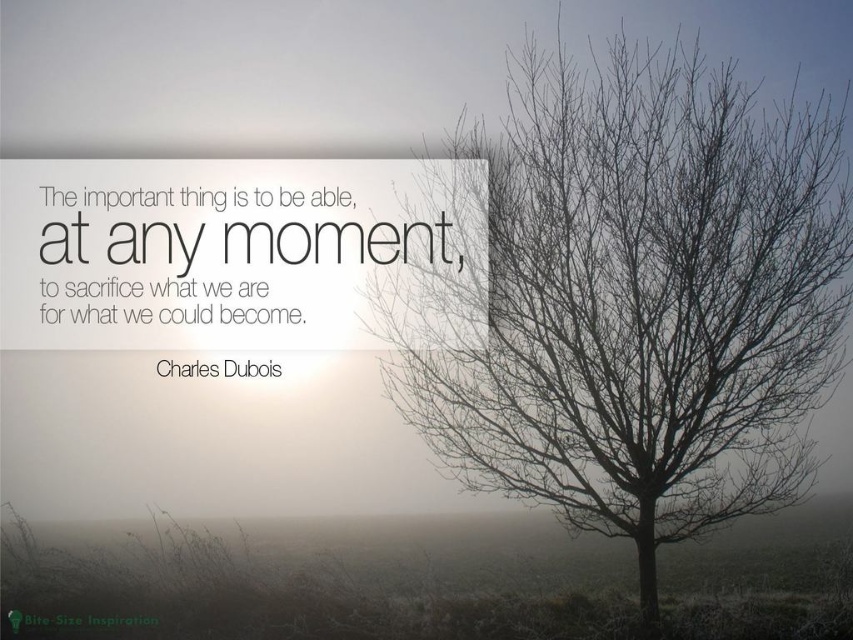
Which is behind, point (587, 456) or point (138, 616)?

The point (138, 616) is behind.

Looking at this image, can you confirm if bare branches at right is positioned to the left of green matte text at lower left?

In fact, bare branches at right is to the right of green matte text at lower left.

Is point (515, 164) positioned after point (16, 612)?

No, it is in front of (16, 612).

At what (x,y) coordinates should I click in order to perform the action: click on bare branches at right. Please return your answer as a coordinate pair (x, y). Image resolution: width=853 pixels, height=640 pixels. Looking at the image, I should click on (631, 298).